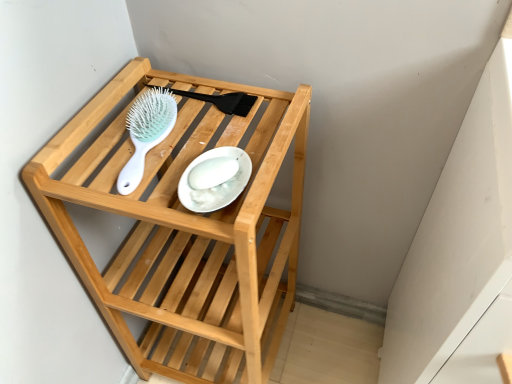
The image size is (512, 384). I want to click on free space to the left of light blue plastic hairbrush at upper center, so click(87, 150).